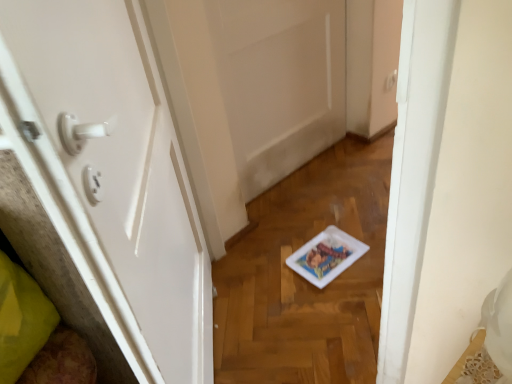
Measure the distance between white glossy door at left, which is the 2th door from back to front, and camera.

They are 16.95 inches apart.

Identify the location of white glossy door at left, arranged as the 1th door when viewed from the front. This screenshot has width=512, height=384. (114, 175).

Based on the photo, what is the approximate width of white glossy door at left, which is the 2th door from back to front?

white glossy door at left, which is the 2th door from back to front, is 15.42 centimeters wide.

What do you see at coordinates (114, 175) in the screenshot? This screenshot has height=384, width=512. I see `white glossy door at left, which is the 2th door from back to front` at bounding box center [114, 175].

The height and width of the screenshot is (384, 512). What do you see at coordinates (279, 82) in the screenshot? I see `white matte door at center, the 1th door when ordered from back to front` at bounding box center [279, 82].

The height and width of the screenshot is (384, 512). Identify the location of white matte door at center, marked as the 2th door in a front-to-back arrangement. (279, 82).

How much space does white matte door at center, marked as the 2th door in a front-to-back arrangement, occupy horizontally?

4.56 inches.

Locate an element on the screen. white glossy door at left, arranged as the 1th door when viewed from the front is located at coordinates (114, 175).

In the image, is white glossy door at left, arranged as the 1th door when viewed from the front, on the left side or the right side of white matte door at center, the 1th door when ordered from back to front?

white glossy door at left, arranged as the 1th door when viewed from the front, is to the left of white matte door at center, the 1th door when ordered from back to front.

Who is more distant, white glossy door at left, arranged as the 1th door when viewed from the front, or white matte door at center, marked as the 2th door in a front-to-back arrangement?

white matte door at center, marked as the 2th door in a front-to-back arrangement, is behind.

Is point (101, 149) closer or farther from the camera than point (300, 136)?

Point (101, 149) is closer to the camera than point (300, 136).

From the image's perspective, is white glossy door at left, arranged as the 1th door when viewed from the front, above or below white matte door at center, marked as the 2th door in a front-to-back arrangement?

white glossy door at left, arranged as the 1th door when viewed from the front, is situated lower than white matte door at center, marked as the 2th door in a front-to-back arrangement, in the image.

From a real-world perspective, between white glossy door at left, arranged as the 1th door when viewed from the front, and white matte door at center, the 1th door when ordered from back to front, who is vertically lower?

In real-world perspective, white matte door at center, the 1th door when ordered from back to front, is lower.

Looking at this image, can you confirm if white glossy door at left, which is the 2th door from back to front, is thinner than white matte door at center, the 1th door when ordered from back to front?

Incorrect, the width of white glossy door at left, which is the 2th door from back to front, is not less than that of white matte door at center, the 1th door when ordered from back to front.

Considering the sizes of objects white glossy door at left, arranged as the 1th door when viewed from the front, and white matte door at center, marked as the 2th door in a front-to-back arrangement, in the image provided, who is shorter, white glossy door at left, arranged as the 1th door when viewed from the front, or white matte door at center, marked as the 2th door in a front-to-back arrangement,?

white matte door at center, marked as the 2th door in a front-to-back arrangement, is shorter.

Is white glossy door at left, which is the 2th door from back to front, smaller than white matte door at center, marked as the 2th door in a front-to-back arrangement?

No.

Is white glossy door at left, which is the 2th door from back to front, spatially inside white matte door at center, the 1th door when ordered from back to front, or outside of it?

white glossy door at left, which is the 2th door from back to front, lies outside white matte door at center, the 1th door when ordered from back to front.

Would you say white glossy door at left, which is the 2th door from back to front, is a long distance from white matte door at center, marked as the 2th door in a front-to-back arrangement?

No, white glossy door at left, which is the 2th door from back to front, is not far away from white matte door at center, marked as the 2th door in a front-to-back arrangement.

Is white glossy door at left, arranged as the 1th door when viewed from the front, aimed at white matte door at center, marked as the 2th door in a front-to-back arrangement?

No, white glossy door at left, arranged as the 1th door when viewed from the front, is not facing towards white matte door at center, marked as the 2th door in a front-to-back arrangement.

Measure the distance between white glossy door at left, which is the 2th door from back to front, and white matte door at center, the 1th door when ordered from back to front.

white glossy door at left, which is the 2th door from back to front, and white matte door at center, the 1th door when ordered from back to front, are 34.53 inches apart.

Identify the location of door below the white matte door at center, the 1th door when ordered from back to front (from the image's perspective). This screenshot has width=512, height=384. (114, 175).

Considering the positions of objects white matte door at center, the 1th door when ordered from back to front, and white glossy door at left, which is the 2th door from back to front, in the image provided, who is more to the left, white matte door at center, the 1th door when ordered from back to front, or white glossy door at left, which is the 2th door from back to front,?

white glossy door at left, which is the 2th door from back to front, is more to the left.

Between white matte door at center, marked as the 2th door in a front-to-back arrangement, and white glossy door at left, which is the 2th door from back to front, which one is positioned in front?

white glossy door at left, which is the 2th door from back to front, is closer to the camera.

Is point (326, 131) behind point (127, 317)?

Yes, point (326, 131) is farther from viewer.

From the image's perspective, between white matte door at center, the 1th door when ordered from back to front, and white glossy door at left, which is the 2th door from back to front, who is located below?

white glossy door at left, which is the 2th door from back to front, from the image's perspective.

From a real-world perspective, is white matte door at center, marked as the 2th door in a front-to-back arrangement, below white glossy door at left, arranged as the 1th door when viewed from the front?

Yes, from a real-world perspective, white matte door at center, marked as the 2th door in a front-to-back arrangement, is beneath white glossy door at left, arranged as the 1th door when viewed from the front.

Can you confirm if white matte door at center, marked as the 2th door in a front-to-back arrangement, is thinner than white glossy door at left, which is the 2th door from back to front?

Correct, the width of white matte door at center, marked as the 2th door in a front-to-back arrangement, is less than that of white glossy door at left, which is the 2th door from back to front.

Who is shorter, white matte door at center, marked as the 2th door in a front-to-back arrangement, or white glossy door at left, which is the 2th door from back to front?

Standing shorter between the two is white matte door at center, marked as the 2th door in a front-to-back arrangement.

Considering the sizes of objects white matte door at center, the 1th door when ordered from back to front, and white glossy door at left, which is the 2th door from back to front, in the image provided, who is bigger, white matte door at center, the 1th door when ordered from back to front, or white glossy door at left, which is the 2th door from back to front,?

white glossy door at left, which is the 2th door from back to front.

Would you say white glossy door at left, which is the 2th door from back to front, is part of white matte door at center, marked as the 2th door in a front-to-back arrangement,'s contents?

No, white matte door at center, marked as the 2th door in a front-to-back arrangement, does not contain white glossy door at left, which is the 2th door from back to front.

Does white matte door at center, marked as the 2th door in a front-to-back arrangement, touch white glossy door at left, which is the 2th door from back to front?

No, white matte door at center, marked as the 2th door in a front-to-back arrangement, is not in contact with white glossy door at left, which is the 2th door from back to front.

Is white matte door at center, the 1th door when ordered from back to front, oriented towards white glossy door at left, arranged as the 1th door when viewed from the front?

No, white matte door at center, the 1th door when ordered from back to front, is not aimed at white glossy door at left, arranged as the 1th door when viewed from the front.

Can you tell me how much white matte door at center, marked as the 2th door in a front-to-back arrangement, and white glossy door at left, which is the 2th door from back to front, differ in facing direction?

There is a 51.5-degree angle between the facing directions of white matte door at center, marked as the 2th door in a front-to-back arrangement, and white glossy door at left, which is the 2th door from back to front.

How far apart are white matte door at center, marked as the 2th door in a front-to-back arrangement, and white glossy door at left, arranged as the 1th door when viewed from the front?

The distance of white matte door at center, marked as the 2th door in a front-to-back arrangement, from white glossy door at left, arranged as the 1th door when viewed from the front, is 87.71 centimeters.

Where is `door behind the white glossy door at left, arranged as the 1th door when viewed from the front`? Image resolution: width=512 pixels, height=384 pixels. door behind the white glossy door at left, arranged as the 1th door when viewed from the front is located at coordinates (279, 82).

Image resolution: width=512 pixels, height=384 pixels. What are the coordinates of `door that appears on the right of white glossy door at left, which is the 2th door from back to front` in the screenshot? It's located at (279, 82).

Locate an element on the screen. The width and height of the screenshot is (512, 384). door behind the white glossy door at left, arranged as the 1th door when viewed from the front is located at coordinates (279, 82).